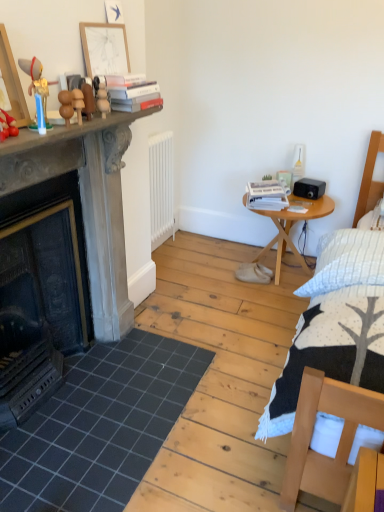
The width and height of the screenshot is (384, 512). In order to click on free point above dark gray tile at lower left (from a real-world perspective) in this screenshot , I will do `click(98, 406)`.